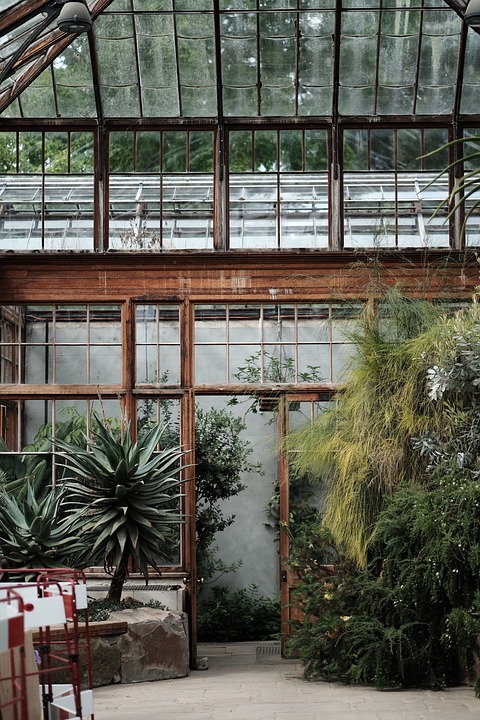
The width and height of the screenshot is (480, 720). Find the location of `grey wall`. grey wall is located at coordinates (249, 546), (244, 505).